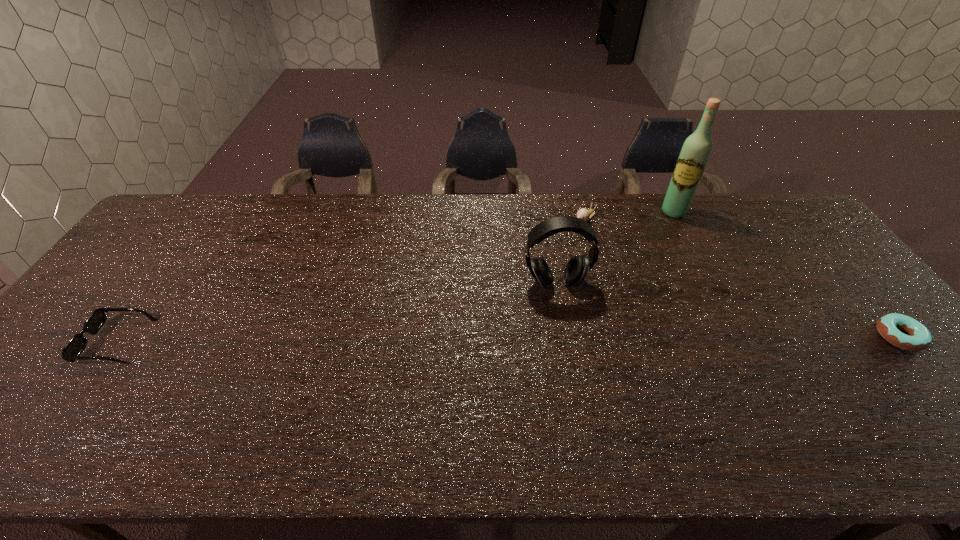
The width and height of the screenshot is (960, 540). I want to click on sunglasses, so click(x=71, y=352).

This screenshot has height=540, width=960. Identify the location of the shortest object. (920, 338).

Find the location of a particular element. doughnut is located at coordinates (920, 338).

Image resolution: width=960 pixels, height=540 pixels. What are the coordinates of `the third farthest object` in the screenshot? It's located at (577, 268).

You are a GUI agent. You are given a task and a screenshot of the screen. Output one action in this format:
    pyautogui.click(x=<x>, y=<y>)
    Task: Click on the second tallest object
    The image size is (960, 540).
    Given the screenshot: What is the action you would take?
    pyautogui.click(x=577, y=268)

Find the location of a particular element. escargot is located at coordinates (584, 214).

Identify the location of wine bottle. The width and height of the screenshot is (960, 540). (694, 155).

The image size is (960, 540). Identify the location of the tallest object. (694, 155).

The image size is (960, 540). Identify the location of vacant area situated 0.050m on the front-facing side of the leftmost object. (70, 341).

In order to click on vacant area located on the front-facing side of the leftmost object in this screenshot , I will do (59, 341).